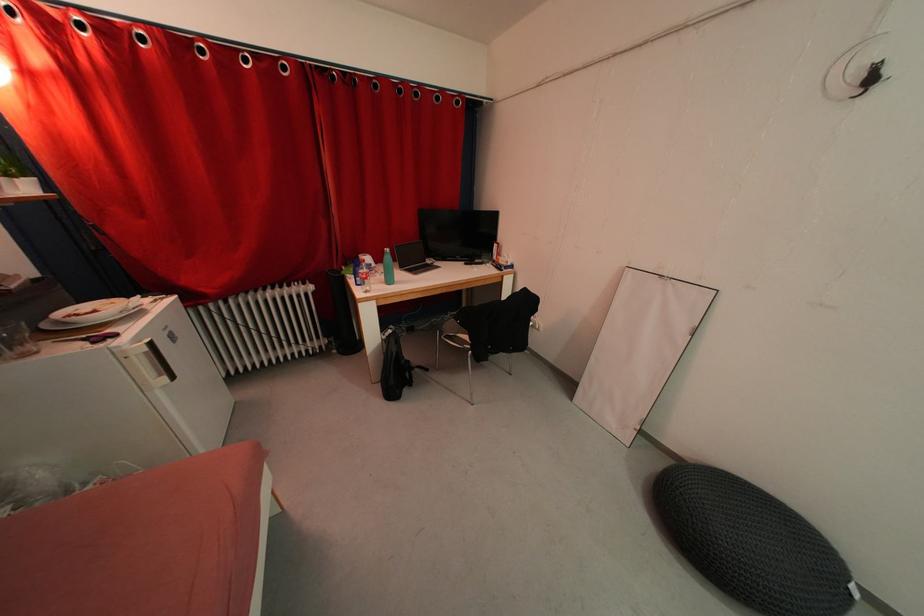
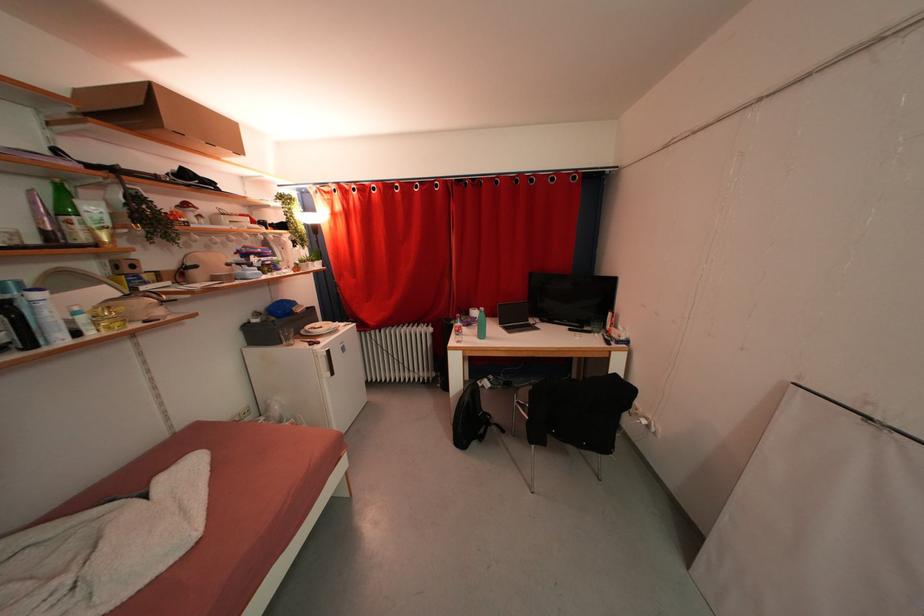
Question: Based on the continuous images, in which direction is the camera rotating? Reply with the corresponding letter.

Choices:
 (A) Left
 (B) Right
 (C) Up
 (D) Down

Answer: (A)